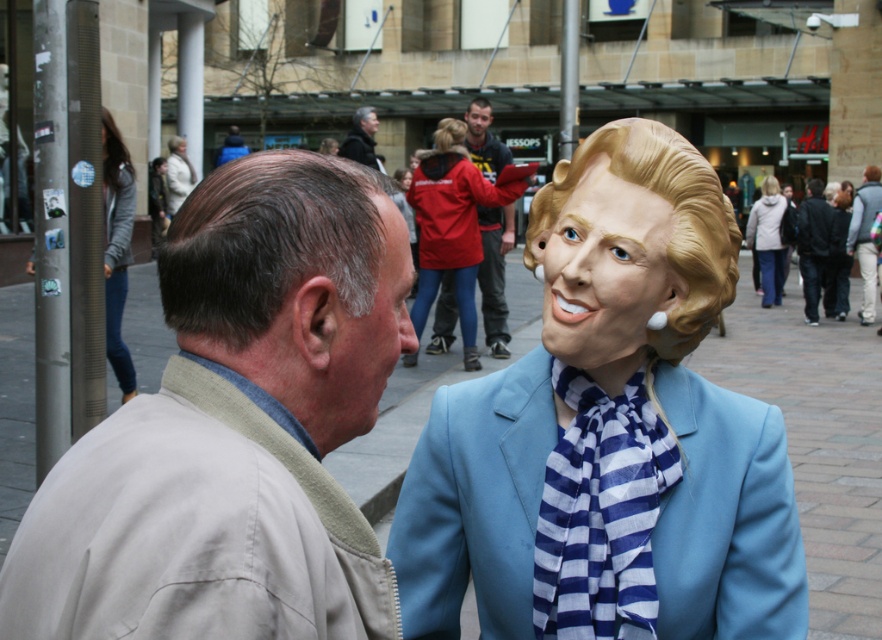
Question: Does blue and white striped scarf at center appear on the left side of matte red jacket at upper center?

Choices:
 (A) yes
 (B) no

Answer: (B)

Question: Which object is the farthest from the matte red jacket at center?

Choices:
 (A) beige fabric jacket at left
 (B) gray matte hair at upper left
 (C) black leather jacket at right
 (D) light beige coat at upper left

Answer: (A)

Question: Can you confirm if beige fabric jacket at left is positioned to the left of smooth plastic face at center?

Choices:
 (A) no
 (B) yes

Answer: (B)

Question: Which of the following is the farthest from the observer?

Choices:
 (A) black leather jacket at right
 (B) beige fabric jacket at left
 (C) gray matte hair at upper left
 (D) blue fabric business suit at right

Answer: (A)

Question: Which object is the farthest from the beige fabric jacket at left?

Choices:
 (A) blue and white striped scarf at center
 (B) red jacket at center
 (C) black leather jacket at right
 (D) dark gray jacket at center

Answer: (A)

Question: From the image, what is the correct spatial relationship of blue fabric business suit at right in relation to gray matte hair at upper left?

Choices:
 (A) above
 (B) below

Answer: (B)